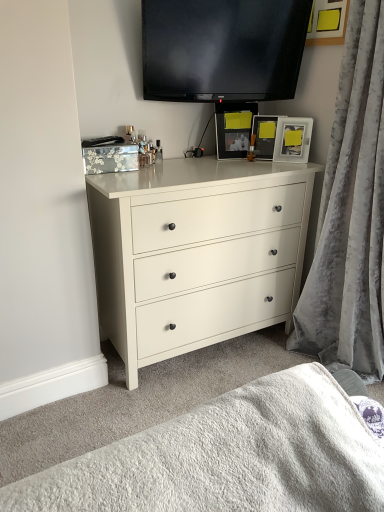
You are a GUI agent. You are given a task and a screenshot of the screen. Output one action in this format:
    pyautogui.click(x=<x>, y=<y>)
    Task: Click on the free space in front of matte black picture frame at center, which is the second picture frame in right-to-left order
    The width and height of the screenshot is (384, 512).
    Given the screenshot: What is the action you would take?
    tap(269, 162)